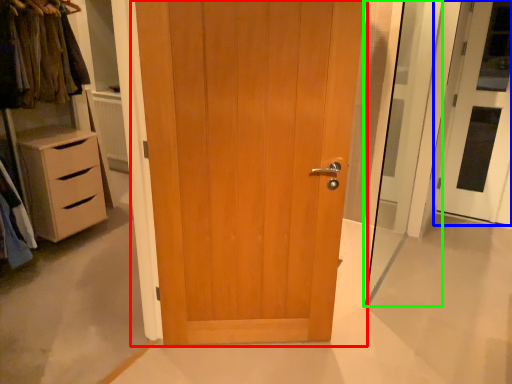
Question: Estimate the real-world distances between objects in this image. Which object is closer to door (highlighted by a red box), door (highlighted by a blue box) or screen door (highlighted by a green box)?

Choices:
 (A) door
 (B) screen door

Answer: (B)